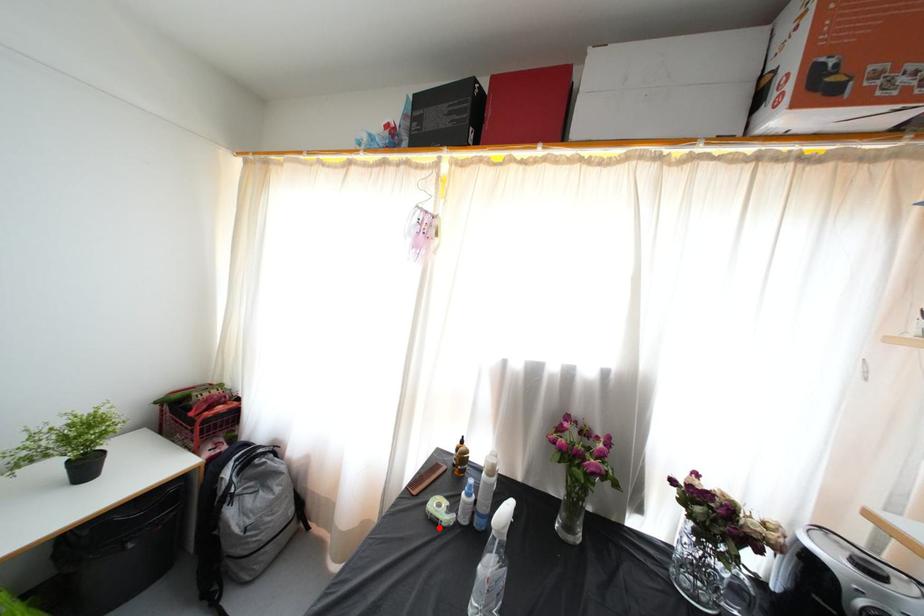
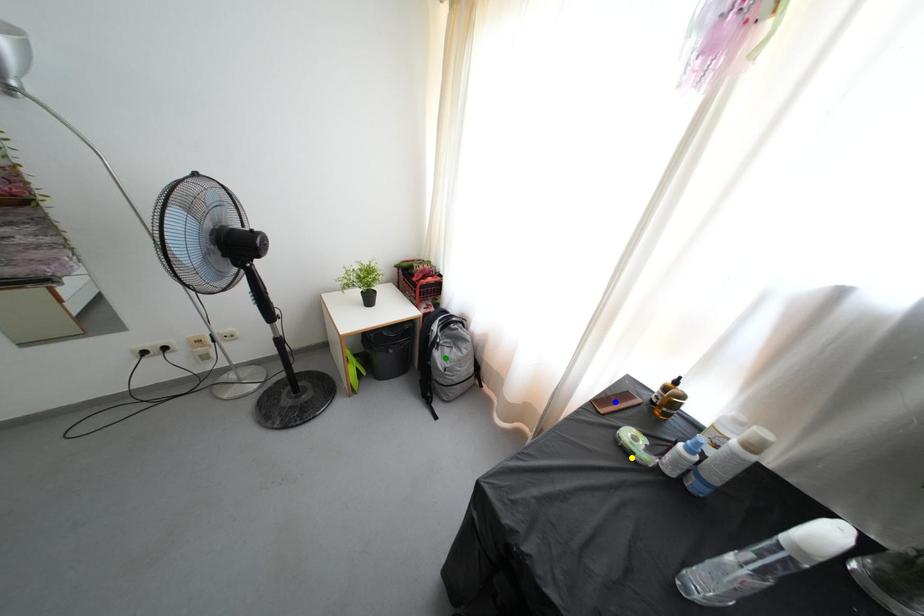
Question: I am providing you with two images of the same scene from different viewpoints. A red point is marked on the first image. You are given multiple points on the second image. Which point in image 2 is actually the same real-world point as the red point in image 1?

Choices:
 (A) blue point
 (B) yellow point
 (C) green point

Answer: (B)